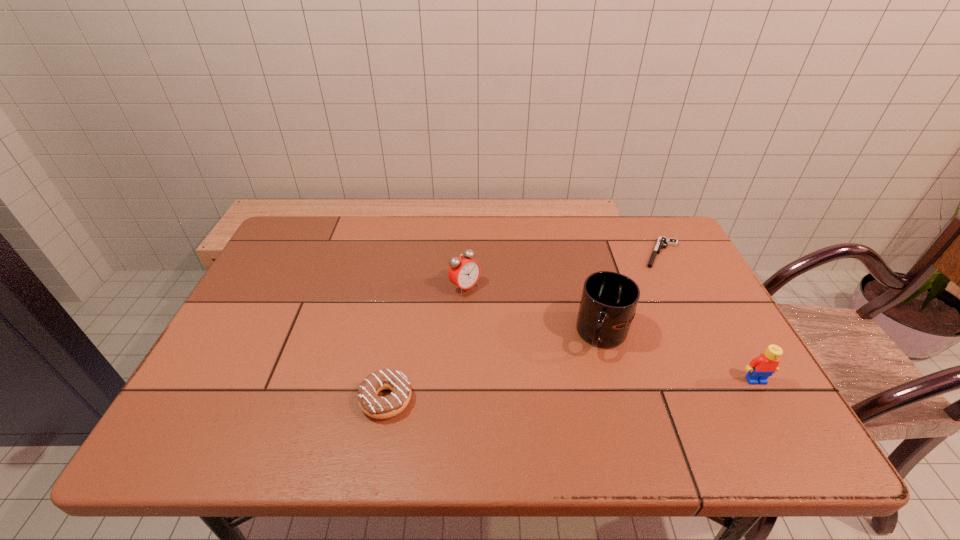
Where is `doughnut that is at the near edge`? doughnut that is at the near edge is located at coordinates (371, 404).

Identify the location of Lego situated at the near edge. (760, 368).

You are a GUI agent. You are given a task and a screenshot of the screen. Output one action in this format:
    pyautogui.click(x=<x>, y=<y>)
    Task: Click on the Lego at the right edge
    
    Given the screenshot: What is the action you would take?
    pyautogui.click(x=760, y=368)

Locate an element on the screen. pistol that is positioned at the right edge is located at coordinates (662, 242).

At what (x,y) coordinates should I click in order to perform the action: click on object present at the far right corner. Please return your answer as a coordinate pair (x, y). The height and width of the screenshot is (540, 960). Looking at the image, I should click on (662, 242).

In order to click on object at the near right corner in this screenshot , I will do [x=760, y=368].

Image resolution: width=960 pixels, height=540 pixels. In the image, there is a desktop. What are the coordinates of `vacant space at the far edge` in the screenshot? It's located at (431, 234).

In order to click on blank space at the near edge of the desktop in this screenshot , I will do `click(286, 384)`.

The width and height of the screenshot is (960, 540). I want to click on free space at the left edge, so click(x=283, y=309).

At what (x,y) coordinates should I click in order to perform the action: click on vacant space at the right edge of the desktop. Please return your answer as a coordinate pair (x, y). This screenshot has height=540, width=960. Looking at the image, I should click on (715, 309).